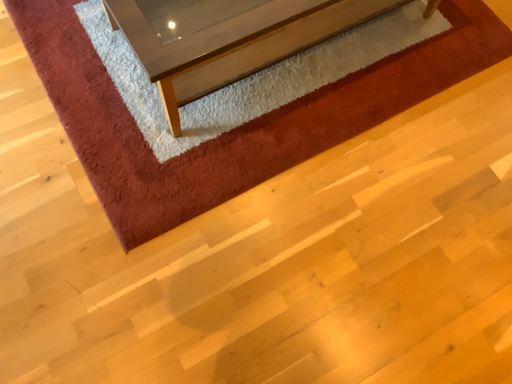
This screenshot has width=512, height=384. What do you see at coordinates (236, 128) in the screenshot?
I see `shaggy red carpet at upper center` at bounding box center [236, 128].

Where is `shaggy red carpet at upper center`? shaggy red carpet at upper center is located at coordinates (236, 128).

What do you see at coordinates (234, 43) in the screenshot? The image size is (512, 384). I see `clear glass coffee table at upper center` at bounding box center [234, 43].

Image resolution: width=512 pixels, height=384 pixels. Find the location of `clear glass coffee table at upper center`. clear glass coffee table at upper center is located at coordinates (234, 43).

Locate an element on the screen. This screenshot has width=512, height=384. shaggy red carpet at upper center is located at coordinates (236, 128).

Does shaggy red carpet at upper center appear on the right side of clear glass coffee table at upper center?

No, shaggy red carpet at upper center is not to the right of clear glass coffee table at upper center.

In the image, is shaggy red carpet at upper center positioned in front of or behind clear glass coffee table at upper center?

shaggy red carpet at upper center is behind clear glass coffee table at upper center.

Is point (436, 69) farther from viewer compared to point (165, 98)?

Yes, point (436, 69) is behind point (165, 98).

From the image's perspective, is shaggy red carpet at upper center on top of clear glass coffee table at upper center?

Actually, shaggy red carpet at upper center appears below clear glass coffee table at upper center in the image.

From a real-world perspective, is shaggy red carpet at upper center positioned over clear glass coffee table at upper center based on gravity?

No.

Between shaggy red carpet at upper center and clear glass coffee table at upper center, which one has smaller width?

clear glass coffee table at upper center is thinner.

Which of these two, shaggy red carpet at upper center or clear glass coffee table at upper center, stands shorter?

shaggy red carpet at upper center.

Between shaggy red carpet at upper center and clear glass coffee table at upper center, which one has smaller size?

Smaller between the two is shaggy red carpet at upper center.

Would you say shaggy red carpet at upper center is outside clear glass coffee table at upper center?

Yes.

Is shaggy red carpet at upper center far from clear glass coffee table at upper center?

They are positioned close to each other.

Is shaggy red carpet at upper center aimed at clear glass coffee table at upper center?

No, shaggy red carpet at upper center is not facing towards clear glass coffee table at upper center.

What's the angular difference between shaggy red carpet at upper center and clear glass coffee table at upper center's facing directions?

0.338 degrees.

The image size is (512, 384). Identify the location of furniture that appears on the right of shaggy red carpet at upper center. (234, 43).

Which object is positioned more to the left, clear glass coffee table at upper center or shaggy red carpet at upper center?

shaggy red carpet at upper center is more to the left.

Is the position of clear glass coffee table at upper center less distant than that of shaggy red carpet at upper center?

Yes, clear glass coffee table at upper center is closer to the viewer.

Which point is more forward, (x=136, y=46) or (x=195, y=186)?

The point (x=136, y=46) is closer to the camera.

From the image's perspective, is clear glass coffee table at upper center located above or below shaggy red carpet at upper center?

Clearly, from the image's perspective, clear glass coffee table at upper center is above shaggy red carpet at upper center.

From a real-world perspective, which object rests below the other?

From a 3D spatial view, shaggy red carpet at upper center is below.

Looking at their sizes, would you say clear glass coffee table at upper center is wider or thinner than shaggy red carpet at upper center?

clear glass coffee table at upper center is thinner than shaggy red carpet at upper center.

In terms of height, does clear glass coffee table at upper center look taller or shorter compared to shaggy red carpet at upper center?

Considering their sizes, clear glass coffee table at upper center has more height than shaggy red carpet at upper center.

Between clear glass coffee table at upper center and shaggy red carpet at upper center, which one has larger size?

clear glass coffee table at upper center.

Looking at this image, is clear glass coffee table at upper center not within shaggy red carpet at upper center?

Yes, clear glass coffee table at upper center is not within shaggy red carpet at upper center.

Are clear glass coffee table at upper center and shaggy red carpet at upper center far apart?

That's not correct — clear glass coffee table at upper center is a little close to shaggy red carpet at upper center.

Is clear glass coffee table at upper center looking in the opposite direction of shaggy red carpet at upper center?

clear glass coffee table at upper center does not have its back to shaggy red carpet at upper center.

Where is `mat lying on the left of clear glass coffee table at upper center`? The image size is (512, 384). mat lying on the left of clear glass coffee table at upper center is located at coordinates (236, 128).

Where is `mat that appears behind the clear glass coffee table at upper center`? This screenshot has height=384, width=512. mat that appears behind the clear glass coffee table at upper center is located at coordinates (236, 128).

Where is `furniture above the shaggy red carpet at upper center (from the image's perspective)`? This screenshot has width=512, height=384. furniture above the shaggy red carpet at upper center (from the image's perspective) is located at coordinates (234, 43).